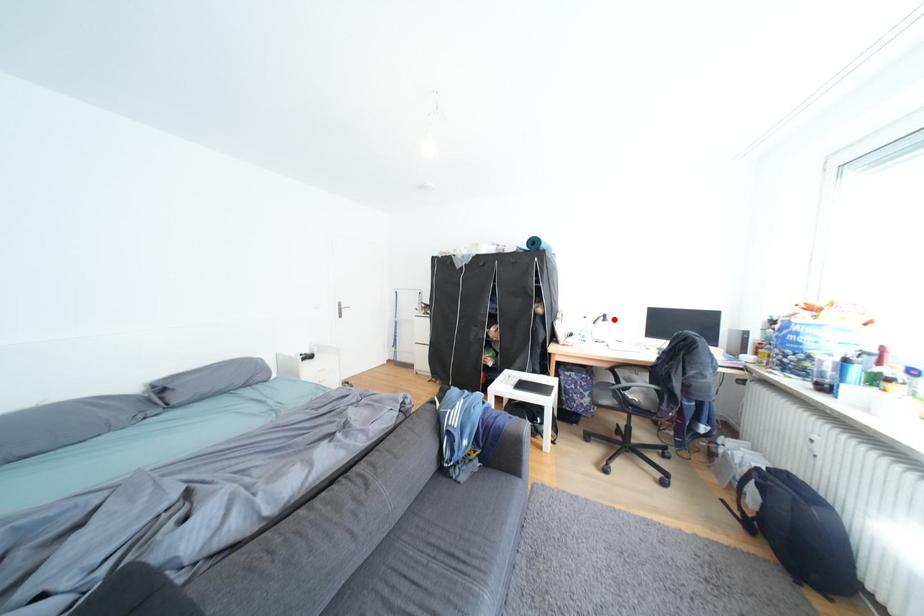
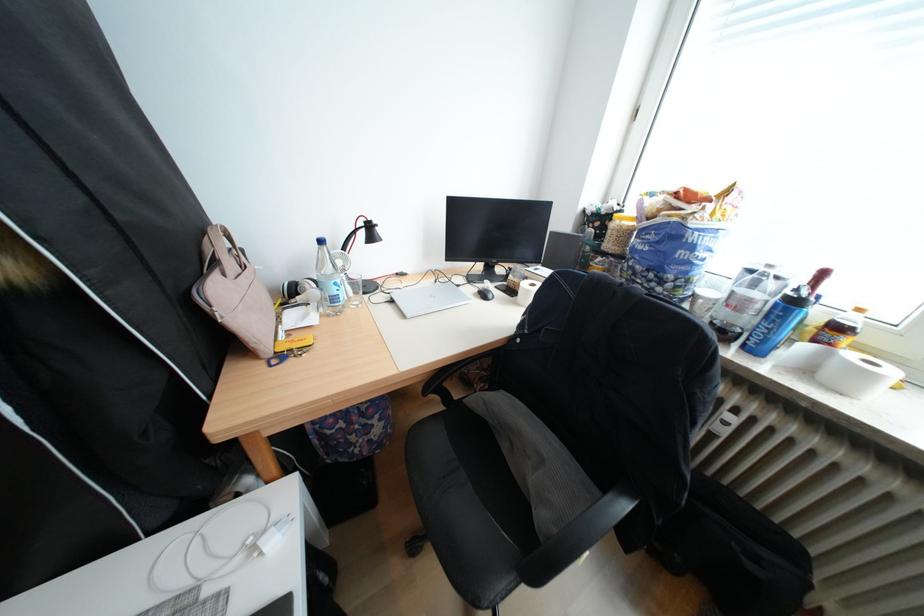
Locate, in the second image, the point that corresponds to the highlighted location in the first image.

(374, 235)